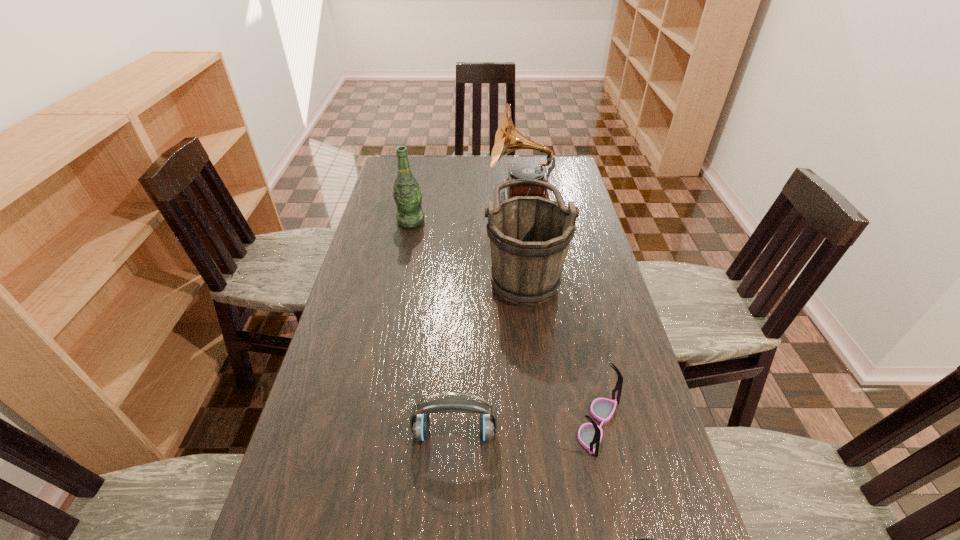
The width and height of the screenshot is (960, 540). I want to click on free space located on the surface of the beer bottle, so pos(402,263).

Where is `free space located on the handle side of the third farthest object`? Image resolution: width=960 pixels, height=540 pixels. free space located on the handle side of the third farthest object is located at coordinates pos(456,271).

This screenshot has width=960, height=540. What are the coordinates of `vacant space located 0.290m on the handle side of the third farthest object` in the screenshot? It's located at (395, 271).

This screenshot has width=960, height=540. What are the coordinates of `vacant space situated 0.340m on the handle side of the third farthest object` in the screenshot? It's located at (379, 271).

The height and width of the screenshot is (540, 960). Find the location of `free space located 0.160m on the ear cups of the headset`. free space located 0.160m on the ear cups of the headset is located at coordinates (450, 524).

Where is `free point located on the left of the farther spectacles`? free point located on the left of the farther spectacles is located at coordinates click(469, 424).

Locate an element on the screen. The height and width of the screenshot is (540, 960). object at the far edge is located at coordinates click(x=507, y=139).

This screenshot has width=960, height=540. Identify the location of object that is at the left edge. coord(408,196).

Find the location of a particular element. phonograph_record present at the right edge is located at coordinates (507, 139).

Find the location of a particular element. bucket at the right edge is located at coordinates (529, 236).